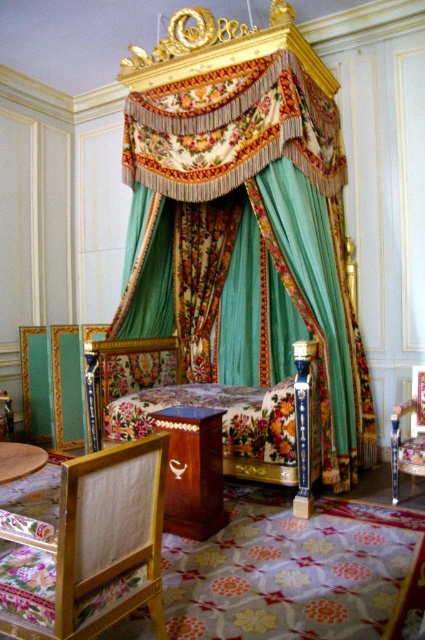
Is floral fabric canopy bed at center positioned behind velvet floral bed at center?

That is True.

Who is shorter, floral fabric canopy bed at center or velvet floral bed at center?

Standing shorter between the two is velvet floral bed at center.

Between point (320, 314) and point (116, 387), which one is positioned in front?

Point (320, 314)

The height and width of the screenshot is (640, 425). Identify the location of floral fabric canopy bed at center. (243, 216).

In the scene shown: Between floral fabric canopy bed at center and wooden table at lower center, which one is positioned higher?

floral fabric canopy bed at center is above.

Can you confirm if floral fabric canopy bed at center is positioned below wooden table at lower center?

Incorrect, floral fabric canopy bed at center is not positioned below wooden table at lower center.

Image resolution: width=425 pixels, height=640 pixels. Describe the element at coordinates (243, 216) in the screenshot. I see `floral fabric canopy bed at center` at that location.

Find the location of `floral fabric canopy bed at center`. floral fabric canopy bed at center is located at coordinates (243, 216).

The height and width of the screenshot is (640, 425). I want to click on wooden polished chair at lower right, so click(x=410, y=435).

Can you confirm if wooden polished chair at lower right is positioned to the right of wooden table at lower left?

Indeed, wooden polished chair at lower right is positioned on the right side of wooden table at lower left.

You are a GUI agent. You are given a task and a screenshot of the screen. Output one action in this format:
    pyautogui.click(x=<x>, y=<y>)
    Task: Click on the wooden polished chair at lower right
    Image resolution: width=425 pixels, height=640 pixels.
    Given the screenshot: What is the action you would take?
    pyautogui.click(x=410, y=435)